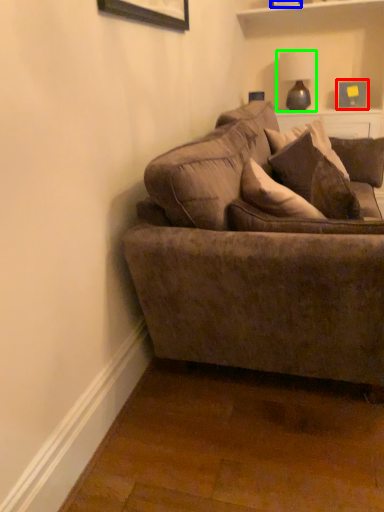
Question: Considering the real-world distances, which object is farthest from picture frame (highlighted by a red box)? picture frame (highlighted by a blue box) or lamp (highlighted by a green box)?

Choices:
 (A) picture frame
 (B) lamp

Answer: (A)